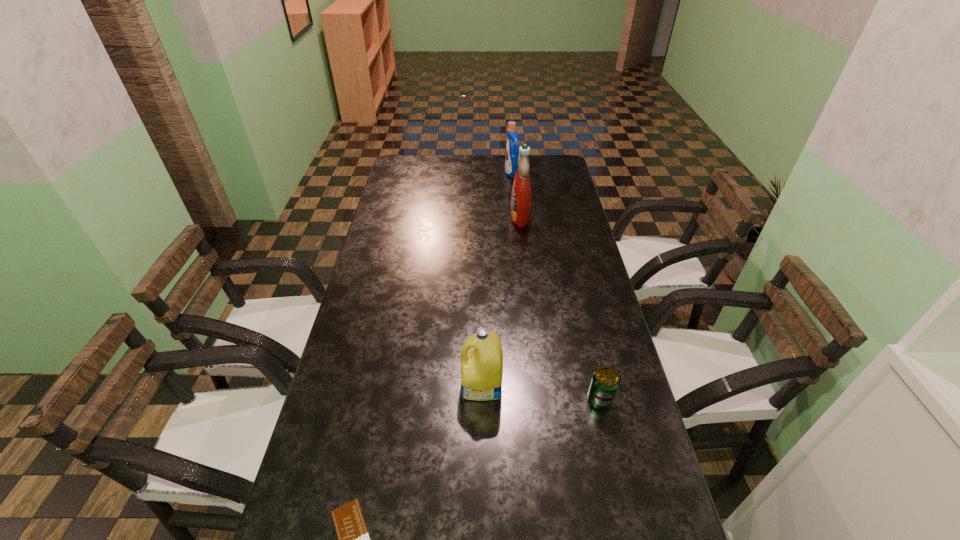
Locate an element on the screen. the second nearest detergent is located at coordinates (521, 190).

Locate an element on the screen. the tallest detergent is located at coordinates (521, 190).

I want to click on the farthest detergent, so click(512, 149).

In order to click on the leftmost detergent in this screenshot , I will do `click(482, 366)`.

Locate an element on the screen. the second object from left to right is located at coordinates (482, 366).

Where is `the second shortest object`? The height and width of the screenshot is (540, 960). the second shortest object is located at coordinates (605, 382).

The height and width of the screenshot is (540, 960). Find the location of `beer can`. beer can is located at coordinates (605, 382).

Where is `free space located on the front surface of the fourth nearest object`? Image resolution: width=960 pixels, height=540 pixels. free space located on the front surface of the fourth nearest object is located at coordinates (451, 217).

You are a GUI agent. You are given a task and a screenshot of the screen. Output one action in this format:
    pyautogui.click(x=<x>, y=<y>)
    Task: Click on the vacant space positioned 0.100m on the front surface of the fourth nearest object
    The height and width of the screenshot is (540, 960).
    Given the screenshot: What is the action you would take?
    pyautogui.click(x=485, y=217)

Where is `free space located 0.250m on the front surface of the fourth nearest object`? free space located 0.250m on the front surface of the fourth nearest object is located at coordinates (446, 217).